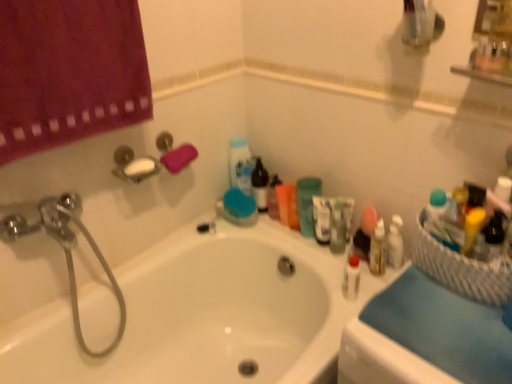
What is the approximate width of blue fabric at right?

blue fabric at right is 8.81 inches wide.

Find the location of a particular element. white plastic soap dish at upper left is located at coordinates (133, 165).

The image size is (512, 384). Identify the location of pink sponge at upper left. (178, 157).

Would you say blue fabric at right is outside pink sponge at upper left?

blue fabric at right is positioned outside pink sponge at upper left.

Is blue fabric at right in contact with pink sponge at upper left?

blue fabric at right and pink sponge at upper left are clearly separated.

Between blue fabric at right and pink sponge at upper left, which one has more height?

With more height is pink sponge at upper left.

Considering the positions of objects white plastic soap dish at upper left and blue fabric at right in the image provided, who is behind, white plastic soap dish at upper left or blue fabric at right?

white plastic soap dish at upper left.

Is white plastic soap dish at upper left oriented towards blue fabric at right?

Yes, white plastic soap dish at upper left is turned towards blue fabric at right.

In terms of size, does white plastic soap dish at upper left appear bigger or smaller than blue fabric at right?

white plastic soap dish at upper left is smaller than blue fabric at right.

Considering the sizes of white plastic soap dish at upper left and blue fabric at right in the image, is white plastic soap dish at upper left taller or shorter than blue fabric at right?

Considering their sizes, white plastic soap dish at upper left has more height than blue fabric at right.

From a real-world perspective, who is located higher, blue fabric at right or chrome metallic showerhead at upper left?

From a 3D spatial view, blue fabric at right is above.

I want to click on counter top on the right of chrome metallic showerhead at upper left, so click(443, 328).

Which object is positioned more to the right, blue fabric at right or chrome metallic showerhead at upper left?

blue fabric at right.

Is pink sponge at upper left next to green matte cup at upper center?

They are not placed beside each other.

Is pink sponge at upper left positioned with its back to green matte cup at upper center?

pink sponge at upper left does not have its back to green matte cup at upper center.

Based on the photo, how many degrees apart are the facing directions of pink sponge at upper left and green matte cup at upper center?

92.4 degrees.

Considering the sizes of objects pink sponge at upper left and green matte cup at upper center in the image provided, who is bigger, pink sponge at upper left or green matte cup at upper center?

Bigger between the two is green matte cup at upper center.

Considering the relative sizes of white plastic soap dish at upper left and white glossy bathtub at center in the image provided, is white plastic soap dish at upper left smaller than white glossy bathtub at center?

Indeed, white plastic soap dish at upper left has a smaller size compared to white glossy bathtub at center.

Which is correct: white plastic soap dish at upper left is inside white glossy bathtub at center, or outside of it?

white plastic soap dish at upper left is located beyond the bounds of white glossy bathtub at center.

From a real-world perspective, is white plastic soap dish at upper left positioned over white glossy bathtub at center based on gravity?

Yes, from a real-world perspective, white plastic soap dish at upper left is above white glossy bathtub at center.

Which is closer, [137,165] or [264,361]?

Point [137,165] appears to be closer to the viewer than point [264,361].

How many degrees apart are the facing directions of green matte cup at upper center and white plastic soap dish at upper left?

They differ by 81.6 degrees in their facing directions.

Is green matte cup at upper center turned away from white plastic soap dish at upper left?

No, green matte cup at upper center is not facing away from white plastic soap dish at upper left.

Is green matte cup at upper center surrounding white plastic soap dish at upper left?

No, white plastic soap dish at upper left is not inside green matte cup at upper center.

Are green matte cup at upper center and white plastic soap dish at upper left far apart?

They are positioned close to each other.

Considering the relative positions of chrome metallic showerhead at upper left and white plastic soap dish at upper left in the image provided, is chrome metallic showerhead at upper left behind white plastic soap dish at upper left?

No, chrome metallic showerhead at upper left is closer to the camera.

Is point (60, 226) positioned after point (132, 156)?

No, (60, 226) is closer to viewer.

In the scene shown: In the image, is chrome metallic showerhead at upper left on the left side or the right side of white plastic soap dish at upper left?

chrome metallic showerhead at upper left is to the left of white plastic soap dish at upper left.

Consider the image. From a real-world perspective, which is physically above, chrome metallic showerhead at upper left or white plastic soap dish at upper left?

white plastic soap dish at upper left is physically above.

The height and width of the screenshot is (384, 512). What are the coordinates of `bath towel on the left side of blue fabric at right` in the screenshot? It's located at (178, 157).

Locate an element on the screen. Image resolution: width=512 pixels, height=384 pixels. counter top in front of the white plastic soap dish at upper left is located at coordinates point(443,328).

Considering their positions, is white glossy bottle at center positioned closer to blue fabric at right than green matte cup at upper center?

Based on the image, white glossy bottle at center appears to be nearer to blue fabric at right.

In the scene shown: Based on their spatial positions, is blue fabric at right or white plastic soap dish at upper left further from white glossy bottle at center?

white plastic soap dish at upper left is positioned further to the anchor white glossy bottle at center.

Considering their positions, is white glossy bottle at center positioned further to white glossy bathtub at center than white wicker basket at right?

white wicker basket at right is further to white glossy bathtub at center.

Looking at the image, which one is located further to chrome metallic showerhead at upper left, blue fabric at right or green matte cup at upper center?

blue fabric at right lies further to chrome metallic showerhead at upper left than the other object.

Considering their positions, is white glossy bathtub at center positioned closer to white plastic soap dish at upper left than white glossy bottle at center?

white glossy bathtub at center lies closer to white plastic soap dish at upper left than the other object.

Which object lies further to the anchor point green matte cup at upper center, white glossy bottle at center or blue fabric at right?

blue fabric at right lies further to green matte cup at upper center than the other object.

Looking at the image, which one is located closer to green matte cup at upper center, chrome metallic showerhead at upper left or white glossy bottle at center?

white glossy bottle at center lies closer to green matte cup at upper center than the other object.

From the picture: Which object lies further to the anchor point white glossy bathtub at center, blue fabric at right or white glossy bottle at center?

Among the two, blue fabric at right is located further to white glossy bathtub at center.

Where is `shower that lies between pink sponge at upper left and white glossy bathtub at center from top to bottom`? shower that lies between pink sponge at upper left and white glossy bathtub at center from top to bottom is located at coordinates (65, 249).

Identify the location of counter top between pink sponge at upper left and white wicker basket at right. The height and width of the screenshot is (384, 512). (443, 328).

Locate an element on the screen. The height and width of the screenshot is (384, 512). toiletry between pink sponge at upper left and white glossy bottle at center in the horizontal direction is located at coordinates (307, 203).

Where is `mouthwash between pink sponge at upper left and white wicker basket at right`? The height and width of the screenshot is (384, 512). mouthwash between pink sponge at upper left and white wicker basket at right is located at coordinates (351, 278).